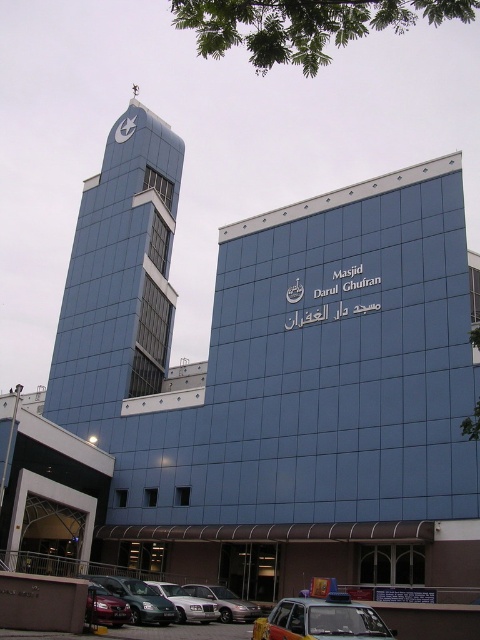
Who is more distant from viewer, (88,611) or (119,129)?

The point (119,129) is more distant.

Is shiny metallic car at lower left in front of metallic clock at upper center?

That is True.

Does point (96, 620) come in front of point (130, 122)?

Yes, it is in front of point (130, 122).

In order to click on shiny metallic car at lower left in this screenshot , I will do `click(106, 608)`.

Can you confirm if metallic green car at lower left is positioned to the right of silver metallic sedan at center?

In fact, metallic green car at lower left is to the left of silver metallic sedan at center.

Between metallic green car at lower left and silver metallic sedan at center, which one is positioned higher?

Positioned higher is metallic green car at lower left.

Find the location of a particular element. metallic green car at lower left is located at coordinates (139, 600).

From the picture: Does metallic taxi cab at lower center have a smaller size compared to shiny metallic car at lower left?

No.

Who is taller, metallic taxi cab at lower center or shiny metallic car at lower left?

With more height is metallic taxi cab at lower center.

Measure the distance between metallic taxi cab at lower center and camera.

18.53 meters

Locate an element on the screen. metallic taxi cab at lower center is located at coordinates (321, 620).